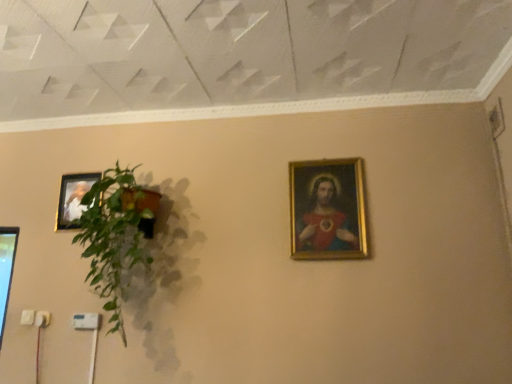
Question: From a real-world perspective, is gold-framed painting at upper right, positioned as the second picture frame in back-to-front order, positioned over matte gold picture frame at upper left, placed as the 2th picture frame when sorted from right to left, based on gravity?

Choices:
 (A) no
 (B) yes

Answer: (A)

Question: Is gold-framed painting at upper right, the 1th picture frame from the front, wider than matte gold picture frame at upper left, arranged as the first picture frame when viewed from the back?

Choices:
 (A) no
 (B) yes

Answer: (A)

Question: From a real-world perspective, is gold-framed painting at upper right, which ranks as the second picture frame in left-to-right order, below matte gold picture frame at upper left, the 1th picture frame when ordered from left to right?

Choices:
 (A) no
 (B) yes

Answer: (B)

Question: Is gold-framed painting at upper right, which is the 1th picture frame from right to left, further to camera compared to matte gold picture frame at upper left, the 1th picture frame when ordered from left to right?

Choices:
 (A) yes
 (B) no

Answer: (B)

Question: Is gold-framed painting at upper right, the 1th picture frame from the front, shorter than matte gold picture frame at upper left, the 1th picture frame when ordered from left to right?

Choices:
 (A) yes
 (B) no

Answer: (B)

Question: Considering the positions of matte gold picture frame at upper left, marked as the 2th picture frame in a front-to-back arrangement, and green leafy plant at left in the image, is matte gold picture frame at upper left, marked as the 2th picture frame in a front-to-back arrangement, taller or shorter than green leafy plant at left?

Choices:
 (A) tall
 (B) short

Answer: (B)

Question: Based on their sizes in the image, would you say matte gold picture frame at upper left, placed as the 2th picture frame when sorted from right to left, is bigger or smaller than green leafy plant at left?

Choices:
 (A) small
 (B) big

Answer: (A)

Question: From a real-world perspective, is matte gold picture frame at upper left, placed as the 2th picture frame when sorted from right to left, positioned above or below green leafy plant at left?

Choices:
 (A) above
 (B) below

Answer: (A)

Question: Is matte gold picture frame at upper left, marked as the 2th picture frame in a front-to-back arrangement, wider or thinner than green leafy plant at left?

Choices:
 (A) thin
 (B) wide

Answer: (A)

Question: Which is correct: gold-framed painting at upper right, which is the 1th picture frame from right to left, is inside green leafy plant at left, or outside of it?

Choices:
 (A) inside
 (B) outside

Answer: (B)

Question: In terms of size, does gold-framed painting at upper right, which ranks as the second picture frame in left-to-right order, appear bigger or smaller than green leafy plant at left?

Choices:
 (A) big
 (B) small

Answer: (B)

Question: From their relative heights in the image, would you say gold-framed painting at upper right, positioned as the second picture frame in back-to-front order, is taller or shorter than green leafy plant at left?

Choices:
 (A) tall
 (B) short

Answer: (B)

Question: Does point (362, 177) appear closer or farther from the camera than point (140, 210)?

Choices:
 (A) closer
 (B) farther

Answer: (B)

Question: Does point (104, 223) appear closer or farther from the camera than point (65, 198)?

Choices:
 (A) farther
 (B) closer

Answer: (B)

Question: Based on their sizes in the image, would you say green leafy plant at left is bigger or smaller than matte gold picture frame at upper left, arranged as the first picture frame when viewed from the back?

Choices:
 (A) big
 (B) small

Answer: (A)